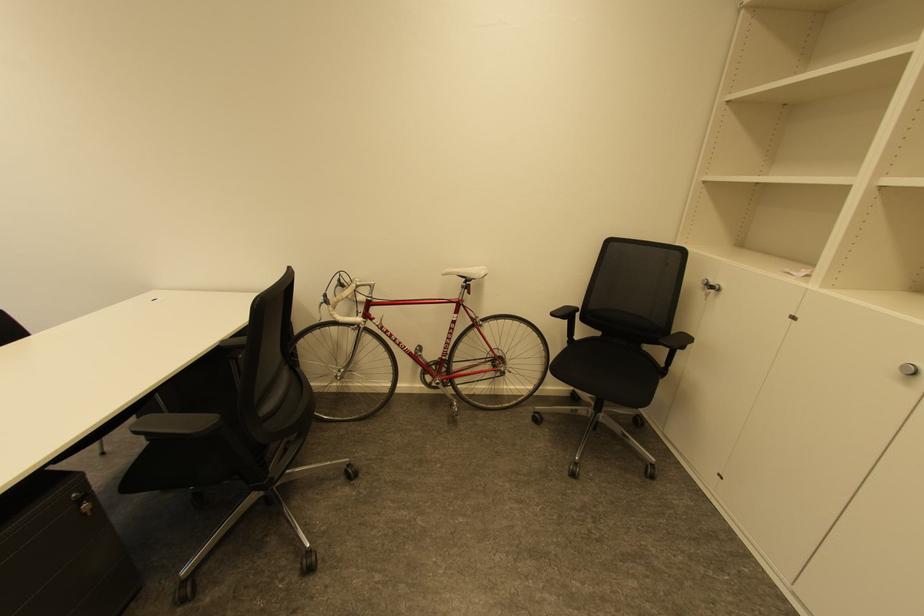
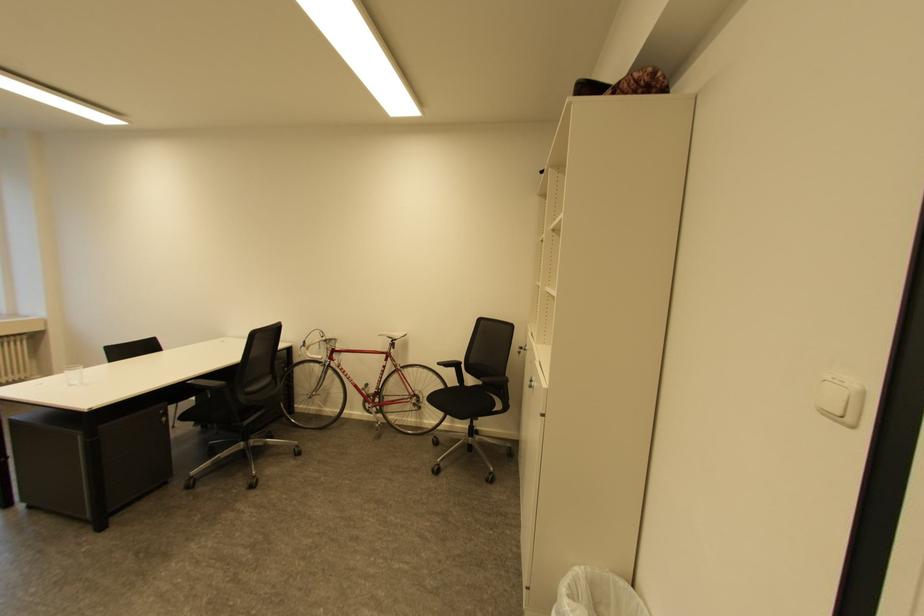
Find the pixel in the second image that matches [573,320] in the first image.

(459, 370)